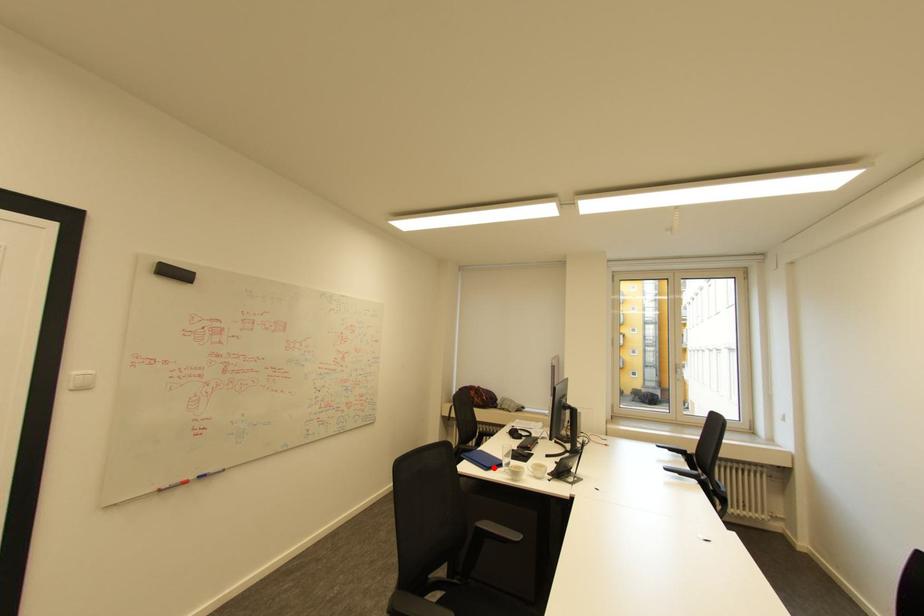
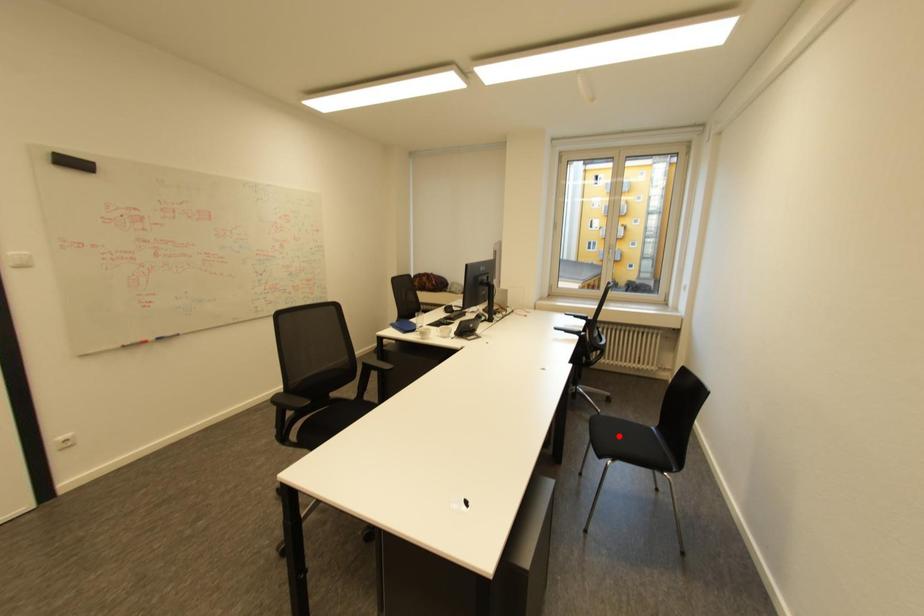
From the picture: I am providing you with two images of the same scene from different viewpoints. A red point is marked on the first image and another point is marked on the second image. Is the marked point in image1 the same physical position as the marked point in image2?

No